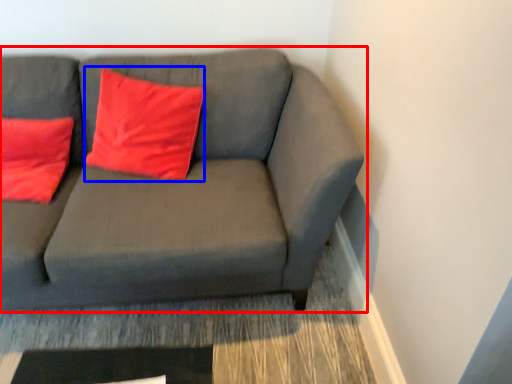
Question: Which object is closer to the camera taking this photo, studio couch (highlighted by a red box) or pillow (highlighted by a blue box)?

Choices:
 (A) studio couch
 (B) pillow

Answer: (A)